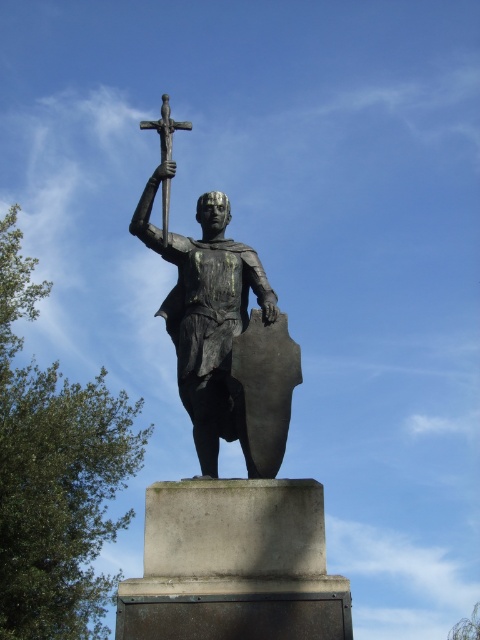
Can you confirm if bronze statue at center is thinner than polished bronze cross at upper center?

No, bronze statue at center is not thinner than polished bronze cross at upper center.

Who is lower down, bronze statue at center or polished bronze cross at upper center?

bronze statue at center is lower down.

Measure the distance between bronze statue at center and camera.

They are 49.21 meters apart.

At what (x,y) coordinates should I click in order to perform the action: click on bronze statue at center. Please return your answer as a coordinate pair (x, y). Looking at the image, I should click on (211, 323).